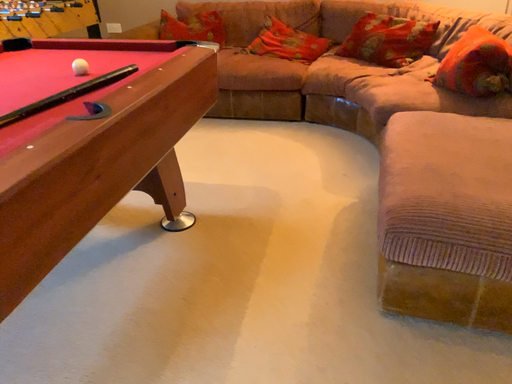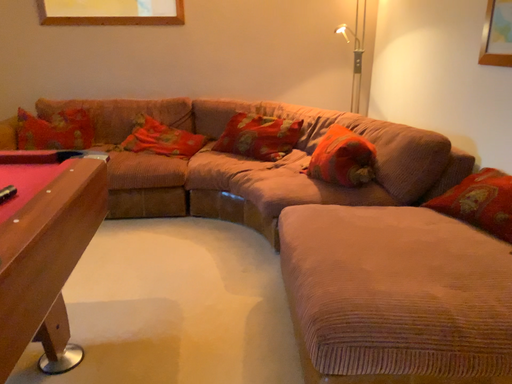
Question: Which way did the camera rotate in the video?

Choices:
 (A) rotated upward
 (B) rotated downward

Answer: (A)